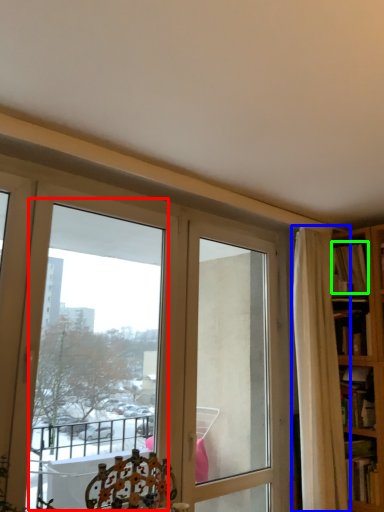
Question: Considering the real-world distances, which object is closest to bay window (highlighted by a red box)? curtain (highlighted by a blue box) or book (highlighted by a green box).

Choices:
 (A) curtain
 (B) book

Answer: (A)